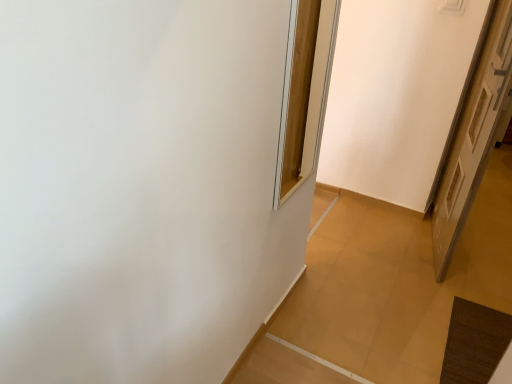
Question: Does point (466, 127) appear closer or farther from the camera than point (325, 72)?

Choices:
 (A) closer
 (B) farther

Answer: (A)

Question: From the image's perspective, is white wooden door at right above or below wooden frame at upper center?

Choices:
 (A) above
 (B) below

Answer: (B)

Question: Considering the positions of white wooden door at right and wooden frame at upper center in the image, is white wooden door at right taller or shorter than wooden frame at upper center?

Choices:
 (A) tall
 (B) short

Answer: (A)

Question: In the image, is wooden frame at upper center positioned in front of or behind white wooden door at right?

Choices:
 (A) behind
 (B) front

Answer: (B)

Question: Is wooden frame at upper center to the left or to the right of white wooden door at right in the image?

Choices:
 (A) right
 (B) left

Answer: (B)

Question: Is wooden frame at upper center spatially inside white wooden door at right, or outside of it?

Choices:
 (A) outside
 (B) inside

Answer: (A)

Question: Does point tap(327, 31) appear closer or farther from the camera than point tap(480, 172)?

Choices:
 (A) closer
 (B) farther

Answer: (B)